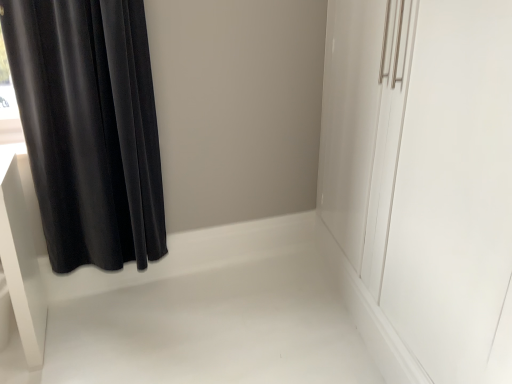
Question: Looking at the image, does velvet black curtain at left seem bigger or smaller compared to white glossy cabinet at right?

Choices:
 (A) big
 (B) small

Answer: (B)

Question: In the image, is velvet black curtain at left positioned in front of or behind white glossy cabinet at right?

Choices:
 (A) front
 (B) behind

Answer: (B)

Question: In the image, is velvet black curtain at left on the left side or the right side of white glossy cabinet at right?

Choices:
 (A) left
 (B) right

Answer: (A)

Question: Considering the positions of point (394, 178) and point (54, 122), is point (394, 178) closer or farther from the camera than point (54, 122)?

Choices:
 (A) farther
 (B) closer

Answer: (B)

Question: In terms of width, does white glossy cabinet at right look wider or thinner when compared to velvet black curtain at left?

Choices:
 (A) wide
 (B) thin

Answer: (A)

Question: In terms of height, does white glossy cabinet at right look taller or shorter compared to velvet black curtain at left?

Choices:
 (A) short
 (B) tall

Answer: (B)

Question: Is white glossy cabinet at right in front of or behind velvet black curtain at left in the image?

Choices:
 (A) front
 (B) behind

Answer: (A)